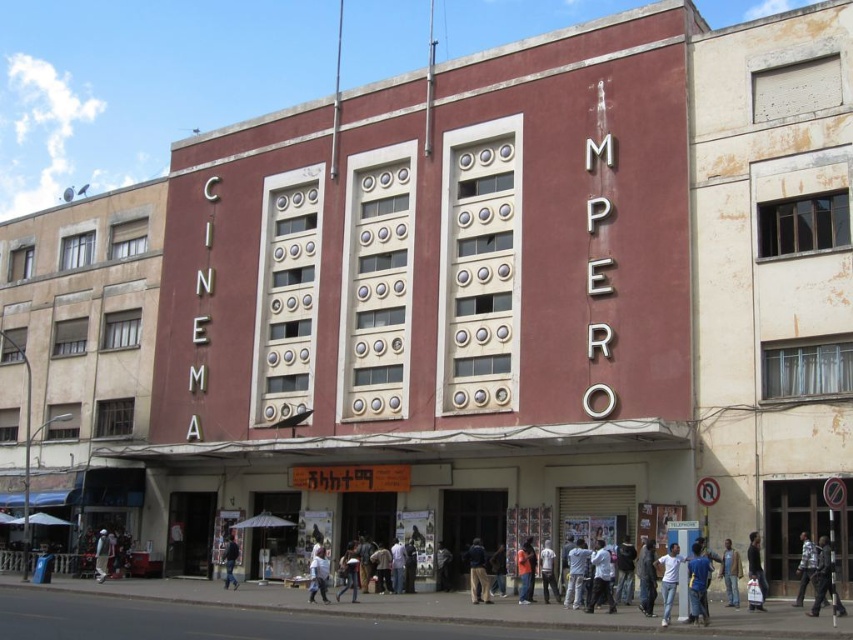
Who is higher up, white cotton shirt at lower right or denim pants at lower center?

Positioned higher is white cotton shirt at lower right.

Does point (670, 552) come behind point (352, 586)?

No, (670, 552) is in front of (352, 586).

Locate an element on the screen. The image size is (853, 640). white cotton shirt at lower right is located at coordinates (669, 579).

Can you confirm if dark blue uniform at lower right is positioned below dark blue jacket at center?

No, dark blue uniform at lower right is not below dark blue jacket at center.

Does point (827, 557) come farther from viewer compared to point (225, 545)?

That is False.

I want to click on dark blue uniform at lower right, so click(824, 579).

Is white cotton shirt at center thinner than dark gray fabric jacket at lower center?

No, white cotton shirt at center is not thinner than dark gray fabric jacket at lower center.

Can you confirm if white cotton shirt at center is bigger than dark gray fabric jacket at lower center?

Indeed, white cotton shirt at center has a larger size compared to dark gray fabric jacket at lower center.

The width and height of the screenshot is (853, 640). In order to click on white cotton shirt at center in this screenshot , I will do `click(318, 576)`.